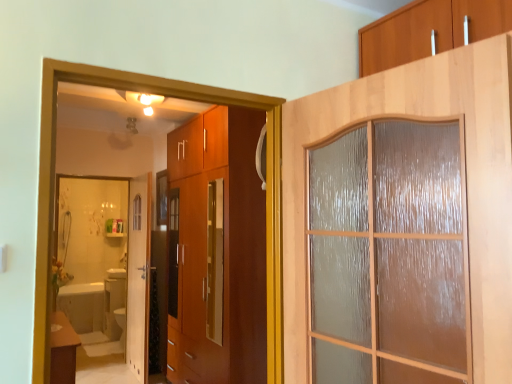
Identify the location of white glossy door at center, the 1th door positioned from the back. (138, 276).

What do you see at coordinates (468, 182) in the screenshot? The height and width of the screenshot is (384, 512). I see `wooden frosted glass door at upper right, the first door when ordered from front to back` at bounding box center [468, 182].

At what (x,y) coordinates should I click in order to perform the action: click on white glossy door at center, acting as the second door starting from the front. Please return your answer as a coordinate pair (x, y). The width and height of the screenshot is (512, 384). Looking at the image, I should click on (138, 276).

The height and width of the screenshot is (384, 512). I want to click on mirror on the right of white glossy bathtub at lower left, so click(94, 259).

Is white glossy mirror at lower left located within white glossy bathtub at lower left?

No, white glossy mirror at lower left is not surrounded by white glossy bathtub at lower left.

From the picture: Considering their positions, is white glossy bathtub at lower left located in front of or behind white glossy mirror at lower left?

In the image, white glossy bathtub at lower left appears behind white glossy mirror at lower left.

Is white glossy bathtub at lower left facing away from white glossy mirror at lower left?

No, white glossy bathtub at lower left's orientation is not away from white glossy mirror at lower left.

Is white glossy mirror at lower left surrounding white glossy door at center, which is the second door in right-to-left order?

Definitely not — white glossy door at center, which is the second door in right-to-left order, is not inside white glossy mirror at lower left.

From the image's perspective, is white glossy mirror at lower left above or below white glossy door at center, which is the second door in right-to-left order?

From the image's perspective, white glossy mirror at lower left appears below white glossy door at center, which is the second door in right-to-left order.

Is white glossy mirror at lower left with white glossy door at center, acting as the second door starting from the front?

No, white glossy mirror at lower left is not with white glossy door at center, acting as the second door starting from the front.

Does white glossy mirror at lower left have a greater width compared to wooden frosted glass door at upper right, the first door when ordered from front to back?

In fact, white glossy mirror at lower left might be narrower than wooden frosted glass door at upper right, the first door when ordered from front to back.

Which object is positioned more to the left, white glossy mirror at lower left or wooden frosted glass door at upper right, the 2th door when ordered from left to right?

Positioned to the left is white glossy mirror at lower left.

From the image's perspective, would you say white glossy mirror at lower left is shown under wooden frosted glass door at upper right, the 2th door when ordered from back to front?

Yes.

Where is `mirror that is behind the wooden frosted glass door at upper right, acting as the 1th door starting from the right`? The width and height of the screenshot is (512, 384). mirror that is behind the wooden frosted glass door at upper right, acting as the 1th door starting from the right is located at coordinates (94, 259).

Which object is wider, wooden frosted glass door at upper right, the 2th door when ordered from left to right, or white glossy mirror at lower left?

With larger width is wooden frosted glass door at upper right, the 2th door when ordered from left to right.

The width and height of the screenshot is (512, 384). What are the coordinates of `door that is the 2nd object to the right of the white glossy mirror at lower left, starting at the anchor` in the screenshot? It's located at (468, 182).

Are wooden frosted glass door at upper right, the first door when ordered from front to back, and white glossy mirror at lower left located far from each other?

Absolutely, wooden frosted glass door at upper right, the first door when ordered from front to back, is distant from white glossy mirror at lower left.

From the image's perspective, which one is positioned lower, white glossy mirror at lower left or matte brown table at lower left?

From the image's view, matte brown table at lower left is below.

Is white glossy mirror at lower left completely or partially outside of matte brown table at lower left?

Yes.

Considering the relative positions of white glossy mirror at lower left and matte brown table at lower left in the image provided, is white glossy mirror at lower left to the right of matte brown table at lower left from the viewer's perspective?

No.

Can white glossy door at center, the 1th door when ordered from left to right, be found inside matte brown table at lower left?

Definitely not — white glossy door at center, the 1th door when ordered from left to right, is not inside matte brown table at lower left.

Is point (69, 357) closer or farther from the camera than point (143, 227)?

Point (69, 357) appears to be closer to the viewer than point (143, 227).

In the image, is matte brown table at lower left on the left side or the right side of white glossy door at center, which is the second door in right-to-left order?

matte brown table at lower left is to the left of white glossy door at center, which is the second door in right-to-left order.

Are wooden frosted glass door at upper right, the 2th door when ordered from back to front, and white glossy bathtub at lower left beside each other?

No, wooden frosted glass door at upper right, the 2th door when ordered from back to front, is not touching white glossy bathtub at lower left.

Considering the points (505, 224) and (102, 288), which point is behind, point (505, 224) or point (102, 288)?

The point (102, 288) is farther.

From a real-world perspective, is wooden frosted glass door at upper right, acting as the 1th door starting from the right, below white glossy bathtub at lower left?

Actually, wooden frosted glass door at upper right, acting as the 1th door starting from the right, is physically above white glossy bathtub at lower left in the real world.

Is wooden frosted glass door at upper right, acting as the 1th door starting from the right, oriented towards white glossy bathtub at lower left?

No, wooden frosted glass door at upper right, acting as the 1th door starting from the right, is not facing towards white glossy bathtub at lower left.

Find the location of a particular element. The image size is (512, 384). bath directly beneath the white glossy mirror at lower left (from a real-world perspective) is located at coordinates (83, 306).

Where is `mirror on the left of white glossy door at center, acting as the second door starting from the front`? This screenshot has height=384, width=512. mirror on the left of white glossy door at center, acting as the second door starting from the front is located at coordinates (94, 259).

Considering their positions, is white glossy bathtub at lower left positioned further to wooden frosted glass door at upper right, acting as the 1th door starting from the right, than white glossy mirror at lower left?

white glossy bathtub at lower left is positioned further to the anchor wooden frosted glass door at upper right, acting as the 1th door starting from the right.

Looking at this image, estimate the real-world distances between objects in this image. Which object is closer to white glossy mirror at lower left, matte brown table at lower left or wooden frosted glass door at upper right, the 2th door when ordered from left to right?

Among the two, matte brown table at lower left is located nearer to white glossy mirror at lower left.

From the image, which object appears to be nearer to matte brown table at lower left, white glossy bathtub at lower left or white glossy door at center, acting as the second door starting from the front?

Based on the image, white glossy door at center, acting as the second door starting from the front, appears to be nearer to matte brown table at lower left.

Considering their positions, is matte brown table at lower left positioned closer to white glossy bathtub at lower left than white glossy door at center, which is the second door in right-to-left order?

white glossy door at center, which is the second door in right-to-left order, lies closer to white glossy bathtub at lower left than the other object.

Looking at the image, which one is located further to white glossy bathtub at lower left, white glossy door at center, acting as the second door starting from the front, or matte brown table at lower left?

The object further to white glossy bathtub at lower left is matte brown table at lower left.

From the image, which object appears to be farther from wooden frosted glass door at upper right, the first door when ordered from front to back, white glossy mirror at lower left or white glossy door at center, which is the second door in right-to-left order?

Among the two, white glossy mirror at lower left is located further to wooden frosted glass door at upper right, the first door when ordered from front to back.

Based on their spatial positions, is wooden frosted glass door at upper right, the first door when ordered from front to back, or white glossy mirror at lower left closer to white glossy bathtub at lower left?

white glossy mirror at lower left is closer to white glossy bathtub at lower left.

Considering their positions, is white glossy door at center, the 1th door positioned from the back, positioned further to white glossy mirror at lower left than white glossy bathtub at lower left?

white glossy door at center, the 1th door positioned from the back.

Identify the location of table between wooden frosted glass door at upper right, acting as the 1th door starting from the right, and white glossy bathtub at lower left in the front-back direction. The width and height of the screenshot is (512, 384). (63, 349).

Where is `door between matte brown table at lower left and white glossy bathtub at lower left from front to back`? The image size is (512, 384). door between matte brown table at lower left and white glossy bathtub at lower left from front to back is located at coordinates (138, 276).

The width and height of the screenshot is (512, 384). Identify the location of table located between wooden frosted glass door at upper right, the 2th door when ordered from left to right, and white glossy door at center, which is the second door in right-to-left order, in the depth direction. (63, 349).

Where is `table positioned between wooden frosted glass door at upper right, the first door when ordered from front to back, and white glossy mirror at lower left from near to far`? Image resolution: width=512 pixels, height=384 pixels. table positioned between wooden frosted glass door at upper right, the first door when ordered from front to back, and white glossy mirror at lower left from near to far is located at coordinates (63, 349).